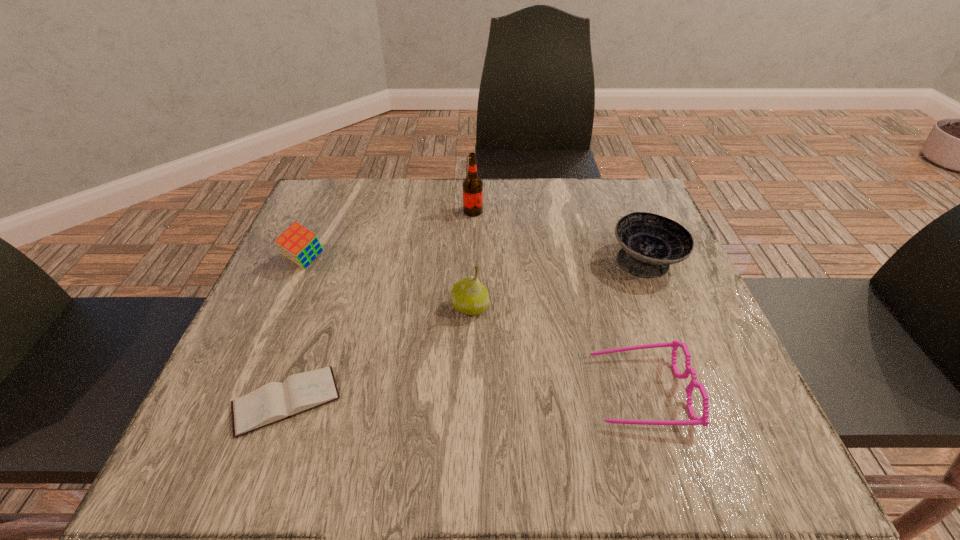
What are the coordinates of `free space located on the right of the cube` in the screenshot? It's located at (468, 261).

Find the location of a particular element. The height and width of the screenshot is (540, 960). free space located 0.050m on the front of the bowl is located at coordinates (663, 305).

Image resolution: width=960 pixels, height=540 pixels. Find the location of `free space located on the arms of the spectacles`. free space located on the arms of the spectacles is located at coordinates (401, 391).

Where is `vacant region located 0.360m on the arms of the spectacles`? The image size is (960, 540). vacant region located 0.360m on the arms of the spectacles is located at coordinates (384, 391).

At what (x,y) coordinates should I click in order to perform the action: click on vacant area located 0.240m on the arms of the spectacles. Please return your answer as a coordinate pair (x, y). The image size is (960, 540). Looking at the image, I should click on (454, 391).

Where is `free spot located 0.170m on the back of the diary`? This screenshot has height=540, width=960. free spot located 0.170m on the back of the diary is located at coordinates pos(323,298).

Find the location of a particular element. This screenshot has width=960, height=540. object situated at the far edge is located at coordinates (472, 185).

Find the location of a particular element. spectacles located in the near edge section of the desktop is located at coordinates (695, 420).

Image resolution: width=960 pixels, height=540 pixels. Identify the location of diary positioned at the near edge. (273, 402).

This screenshot has height=540, width=960. Identify the location of cube present at the left edge. (298, 244).